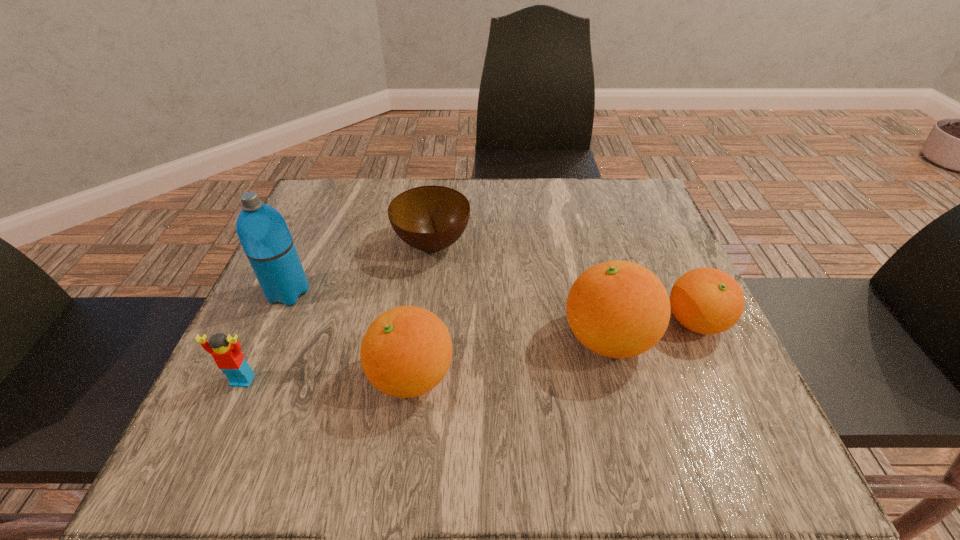
Where is `object present at the near right corner`? Image resolution: width=960 pixels, height=540 pixels. object present at the near right corner is located at coordinates (619, 309).

Find the location of `free space at the far edge`. free space at the far edge is located at coordinates (565, 224).

You are a GUI agent. You are given a task and a screenshot of the screen. Output one action in this format:
    pyautogui.click(x=<x>, y=<y>)
    Task: Click on the free space at the near edge of the desktop
    The width and height of the screenshot is (960, 540).
    Given the screenshot: What is the action you would take?
    pyautogui.click(x=591, y=372)

The height and width of the screenshot is (540, 960). What are the coordinates of `vacant area at the left edge` in the screenshot? It's located at coord(310,359).

Locate an element on the screen. vacant space at the right edge is located at coordinates (653, 348).

This screenshot has width=960, height=540. In the image, there is a desktop. Identify the location of vacant region at the far left corner. (340, 184).

This screenshot has width=960, height=540. I want to click on vacant space at the near left corner of the desktop, so click(x=300, y=396).

Locate an element on the screen. Image resolution: width=960 pixels, height=540 pixels. vacant area at the near right corner of the desktop is located at coordinates (703, 387).

Image resolution: width=960 pixels, height=540 pixels. I want to click on empty space between the shortest orange and the leftmost orange, so click(554, 349).

This screenshot has height=540, width=960. In order to click on free space between the shortest orange and the bowl in this screenshot , I will do `click(564, 283)`.